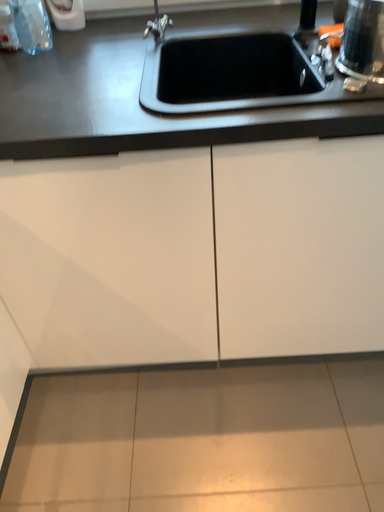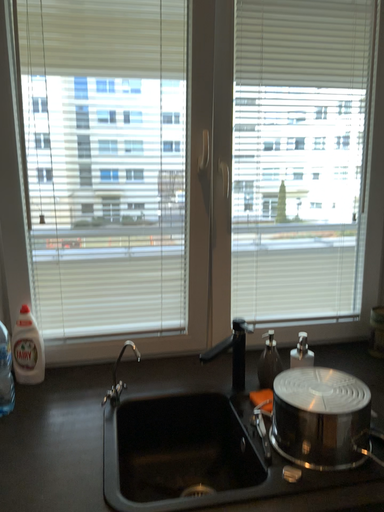
Question: Which way did the camera rotate in the video?

Choices:
 (A) rotated upward
 (B) rotated downward

Answer: (A)